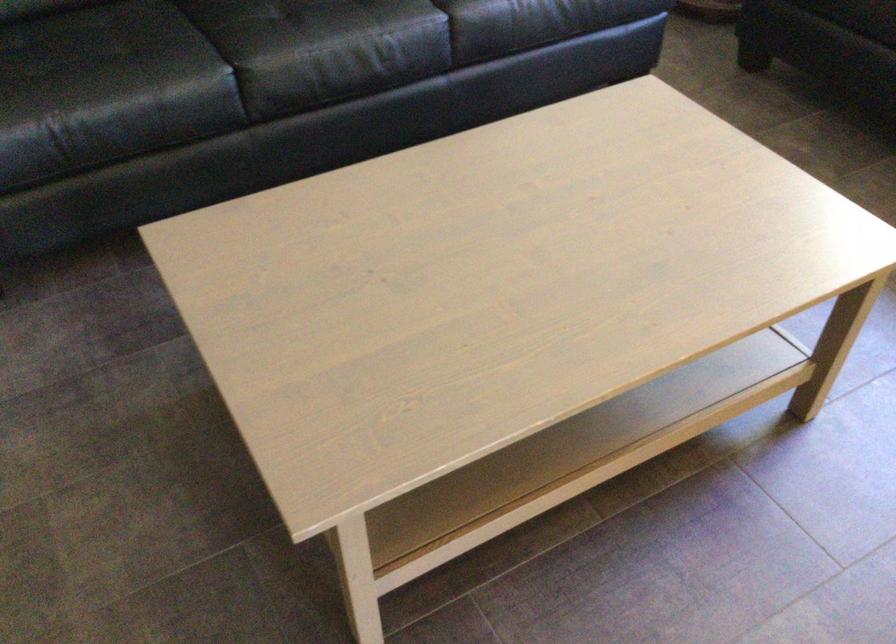
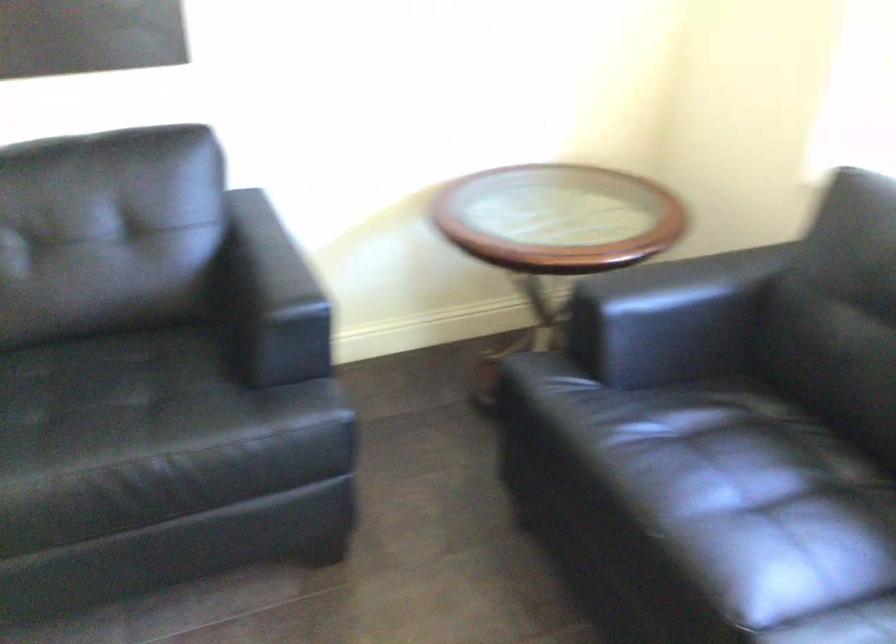
In a continuous first-person perspective shot, in which direction is the camera moving?

The cameraman moved toward right, forward.